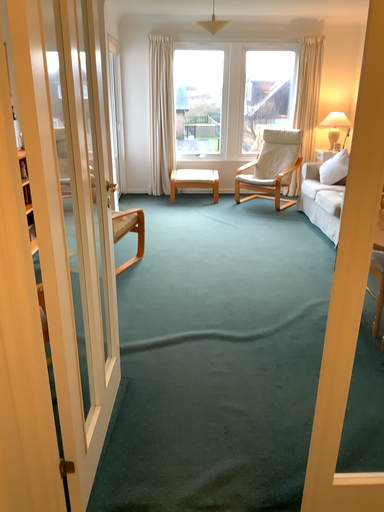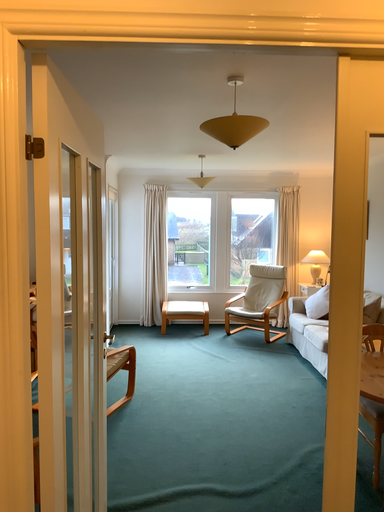
Question: Which way did the camera rotate in the video?

Choices:
 (A) rotated upward
 (B) rotated downward

Answer: (A)